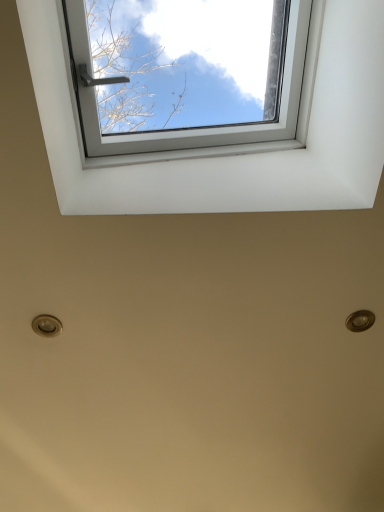
Question: Should I look upward or downward to see transparent glass window at upper center?

Choices:
 (A) down
 (B) up

Answer: (B)